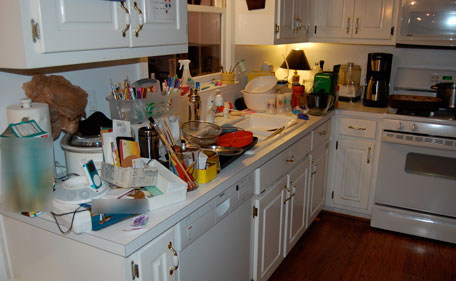
I want to click on window, so click(190, 38).